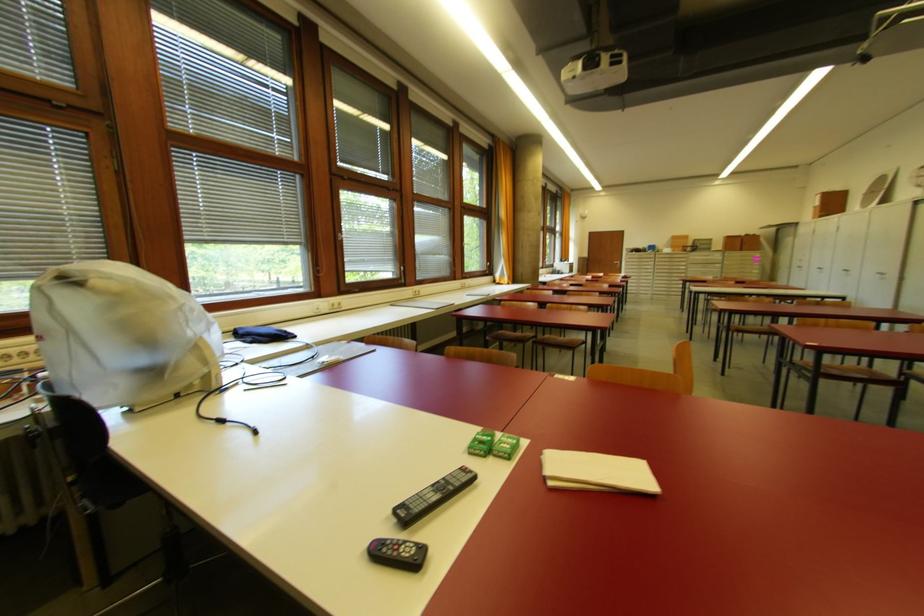
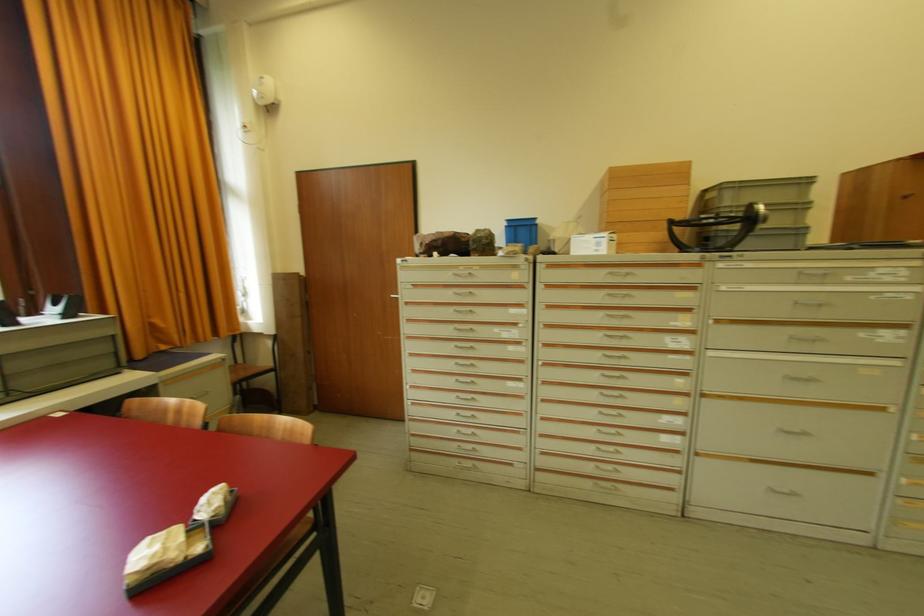
In the second image, find the point that corresponds to pixel 664 254 in the first image.

(570, 254)